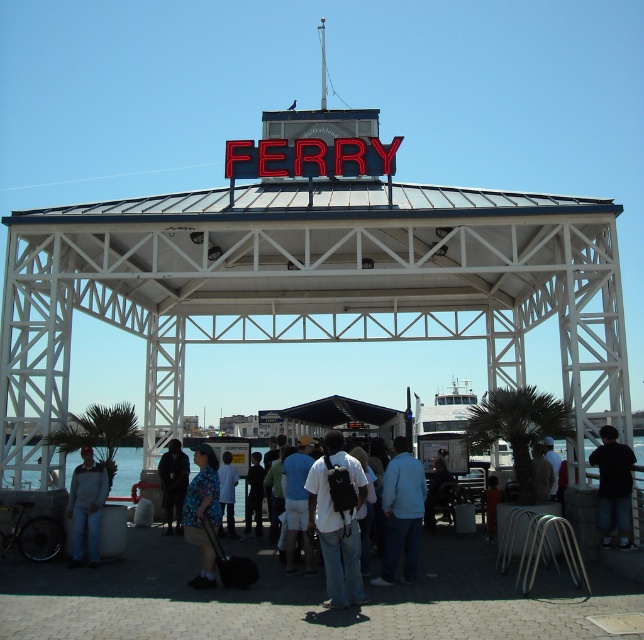
You are a photographer trying to capture a candid shot of the white cotton shirt at center without including the dark fabric shirt at center in the frame. Based on their positions, is this possible?

The dark fabric shirt at center is in front of the white cotton shirt at center, so it would block the view. Therefore, capturing the white cotton shirt at center without the dark fabric shirt at center in the frame is not possible.

In the scene shown: You are standing at the ferry terminal and see the dark fabric shirt at center. If you want to approach it, how many steps would you need to take if each step covers about 2.5 feet?

The dark fabric shirt at center is 162.83 feet away. Dividing the distance by the step length of 2.5 feet per step gives approximately 65 steps. Therefore, you would need to take around 65 steps to reach the dark fabric shirt at center.